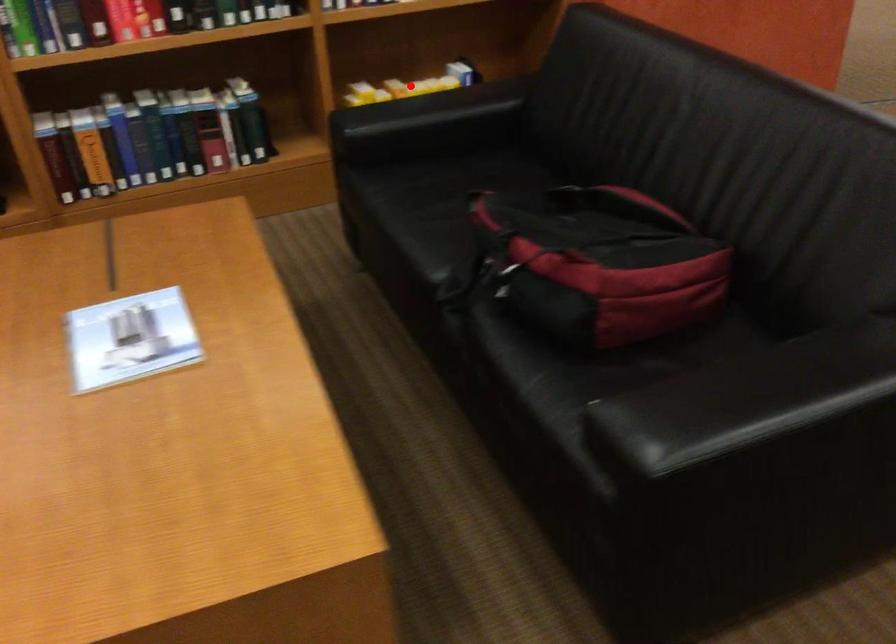
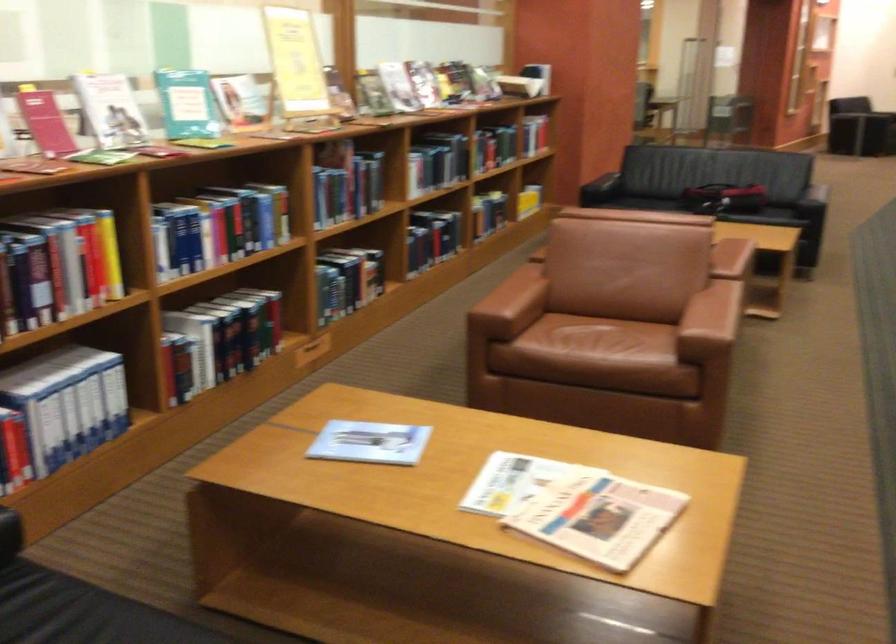
Question: I am providing you with two images of the same scene from different viewpoints. Image1 has a red point marked. In image2, the corresponding 3D location appears at what relative position? Reply with the corresponding letter.

Choices:
 (A) Closer
 (B) Farther

Answer: (B)